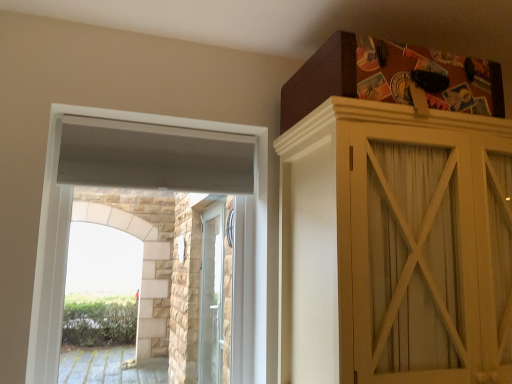
Question: Considering the positions of white textured window at upper left and matte wooden cupboard at upper right in the image, is white textured window at upper left bigger or smaller than matte wooden cupboard at upper right?

Choices:
 (A) big
 (B) small

Answer: (B)

Question: Is white textured window at upper left taller or shorter than matte wooden cupboard at upper right?

Choices:
 (A) tall
 (B) short

Answer: (A)

Question: From the image's perspective, relative to matte wooden cupboard at upper right, is white textured window at upper left above or below?

Choices:
 (A) below
 (B) above

Answer: (B)

Question: From the image's perspective, is matte wooden cupboard at upper right located above or below white textured window at upper left?

Choices:
 (A) above
 (B) below

Answer: (B)

Question: Relative to white textured window at upper left, is matte wooden cupboard at upper right in front or behind?

Choices:
 (A) front
 (B) behind

Answer: (A)

Question: Which is correct: matte wooden cupboard at upper right is inside white textured window at upper left, or outside of it?

Choices:
 (A) inside
 (B) outside

Answer: (B)

Question: Does point (474, 135) appear closer or farther from the camera than point (50, 200)?

Choices:
 (A) closer
 (B) farther

Answer: (A)